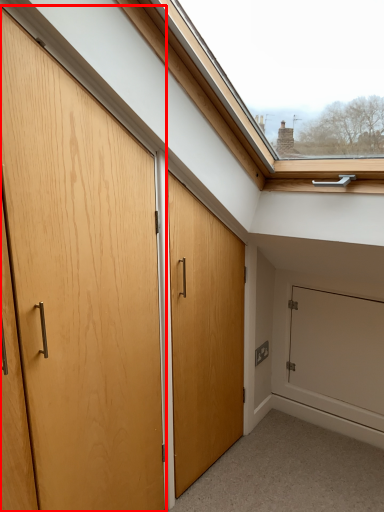
Question: Observing the image, what is the correct spatial positioning of door (annotated by the red box) in reference to screen door?

Choices:
 (A) right
 (B) left

Answer: (B)